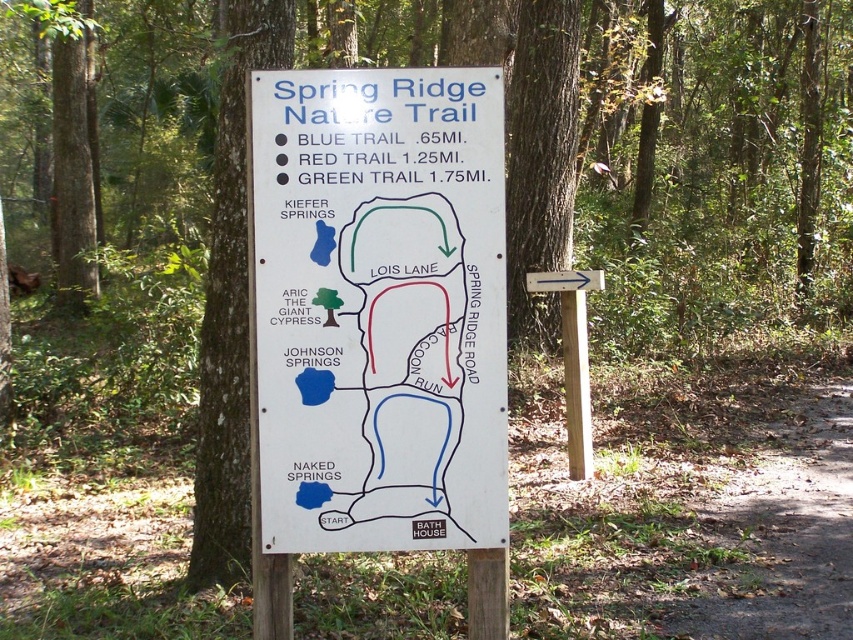
Is point (850, 508) less distant than point (223, 470)?

No, it is behind (223, 470).

Is dirt path at lower right positioned before brown rough bark tree at left?

That is True.

Does point (799, 628) come farther from viewer compared to point (241, 250)?

No, it is not.

Where is `dirt path at lower right`? dirt path at lower right is located at coordinates (782, 536).

Does point (408, 456) lie in front of point (276, 61)?

Yes, point (408, 456) is closer to viewer.

Between point (408, 508) and point (225, 490), which one is positioned behind?

Point (225, 490)

The width and height of the screenshot is (853, 640). What are the coordinates of `white paper sign at center` in the screenshot? It's located at (378, 323).

In the scene shown: Does white paper sign at center have a smaller size compared to dirt path at lower right?

Correct, white paper sign at center occupies less space than dirt path at lower right.

Which is more to the left, white paper sign at center or dirt path at lower right?

From the viewer's perspective, white paper sign at center appears more on the left side.

Is point (379, 224) farther from viewer compared to point (831, 618)?

No, it is not.

This screenshot has width=853, height=640. Identify the location of white paper sign at center. (378, 323).